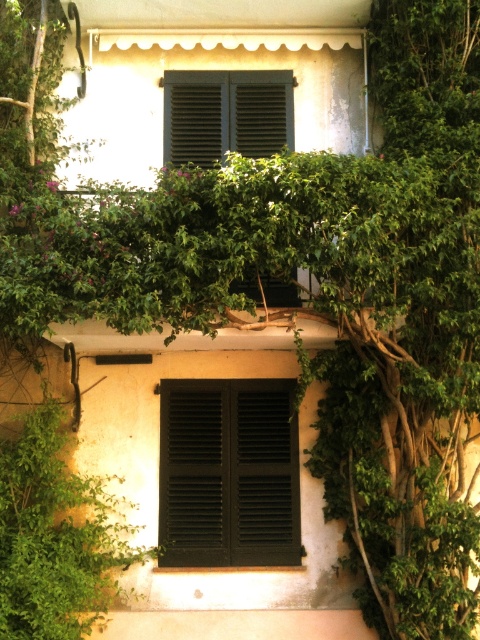
Between matte black shutters at center and matte black shutters at upper center, which one is positioned lower?

Positioned lower is matte black shutters at center.

Is matte black shutters at center wider than matte black shutters at upper center?

Yes, matte black shutters at center is wider than matte black shutters at upper center.

Between point (231, 403) and point (168, 76), which one is positioned in front?

Point (231, 403)

I want to click on matte black shutters at center, so click(x=228, y=474).